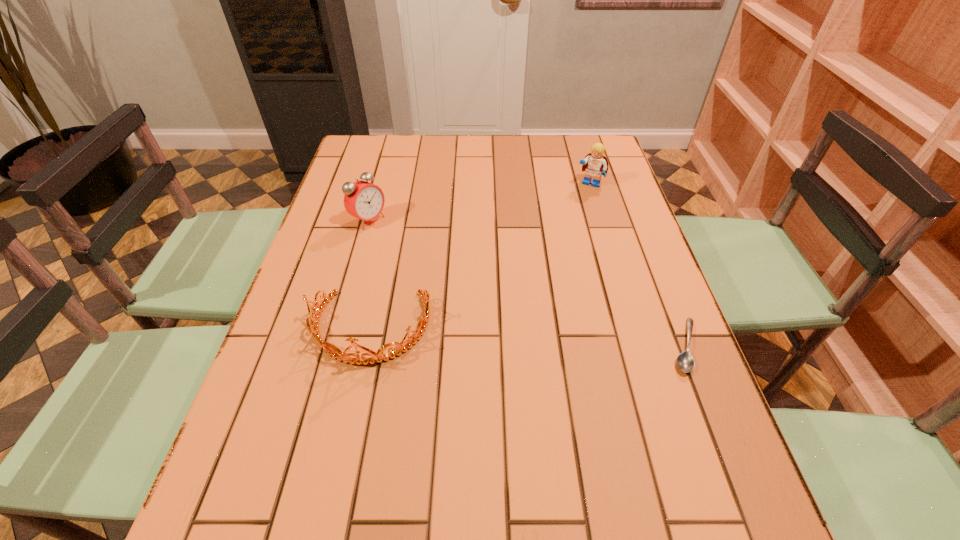
Identify the location of tiara. The image size is (960, 540). coord(336,353).

You are a GUI agent. You are given a task and a screenshot of the screen. Output one action in this format:
    pyautogui.click(x=<x>, y=<y>)
    Task: Click on the rightmost object
    
    Given the screenshot: What is the action you would take?
    pyautogui.click(x=685, y=361)

Identify the location of soupspoon. (685, 361).

Locate an element on the screen. The image size is (960, 540). the farthest object is located at coordinates (595, 164).

This screenshot has height=540, width=960. I want to click on Lego, so click(x=595, y=164).

Locate an element on the screen. This screenshot has height=540, width=960. alarm clock is located at coordinates (363, 200).

You are a GUI agent. You are given a task and a screenshot of the screen. Output one action in this format:
    pyautogui.click(x=<x>, y=<y>)
    Task: Click on the free space located on the front-facing side of the tiara
    The width and height of the screenshot is (960, 540).
    Given the screenshot: What is the action you would take?
    pyautogui.click(x=352, y=411)

Locate an element on the screen. This screenshot has width=960, height=540. blank area located 0.180m on the left of the rightmost object is located at coordinates (586, 346).

Image resolution: width=960 pixels, height=540 pixels. In order to click on free space located on the front-facing side of the Lego in this screenshot , I will do `click(578, 204)`.

The height and width of the screenshot is (540, 960). In order to click on blank space located 0.180m on the front-facing side of the Lego in this screenshot , I will do `click(568, 223)`.